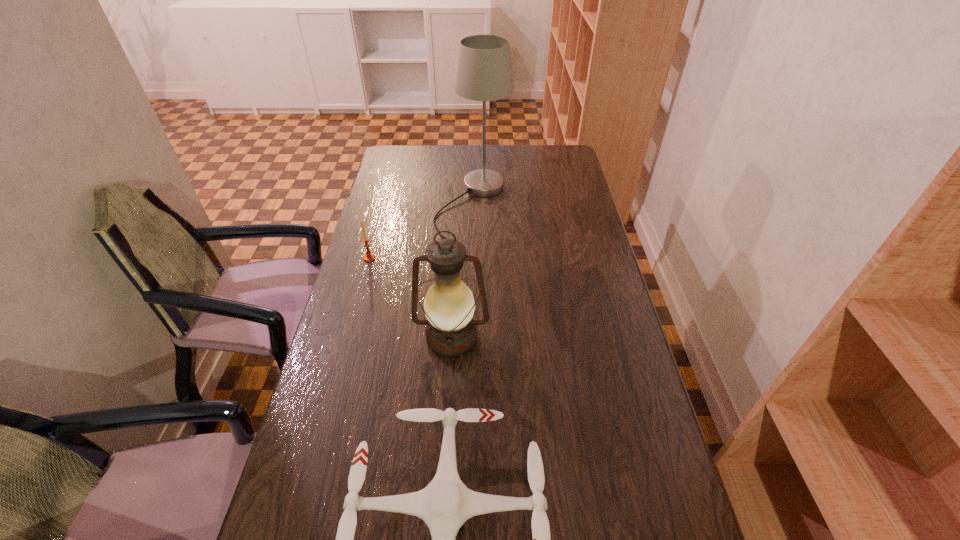
This screenshot has height=540, width=960. In the image, there is a desktop. Find the location of `vacant space at the far edge`. vacant space at the far edge is located at coordinates (508, 169).

I want to click on free location at the left edge, so click(372, 268).

Where is `free space at the right edge of the desktop`? This screenshot has width=960, height=540. free space at the right edge of the desktop is located at coordinates (588, 222).

You are a GUI agent. You are given a task and a screenshot of the screen. Output one action in this format:
    pyautogui.click(x=<x>, y=<y>)
    Task: Click on the free region at the far left corner
    This screenshot has height=540, width=960.
    Given the screenshot: What is the action you would take?
    pyautogui.click(x=406, y=170)

Find the location of a particular element. This screenshot has height=540, width=960. free location at the far right corner is located at coordinates (562, 166).

Where is `free space between the third farthest object and the table lamp`? The width and height of the screenshot is (960, 540). free space between the third farthest object and the table lamp is located at coordinates point(462,271).

Find the location of a particular element. This screenshot has height=540, width=960. vacant area between the candle_holder and the oil lamp is located at coordinates (411, 297).

The image size is (960, 540). I want to click on free space between the oil lamp and the tallest object, so click(462, 271).

Locate an element on the screen. The image size is (960, 540). object that can be found as the closest to the second tallest object is located at coordinates (445, 504).

Identify which object is the closest to the tallest object. Please provide its 2D coordinates. Your answer should be formatted as a tuple, i.e. [(x, y)], where the tuple contains the x and y coordinates of a point satisfying the conditions above.

[(369, 257)]